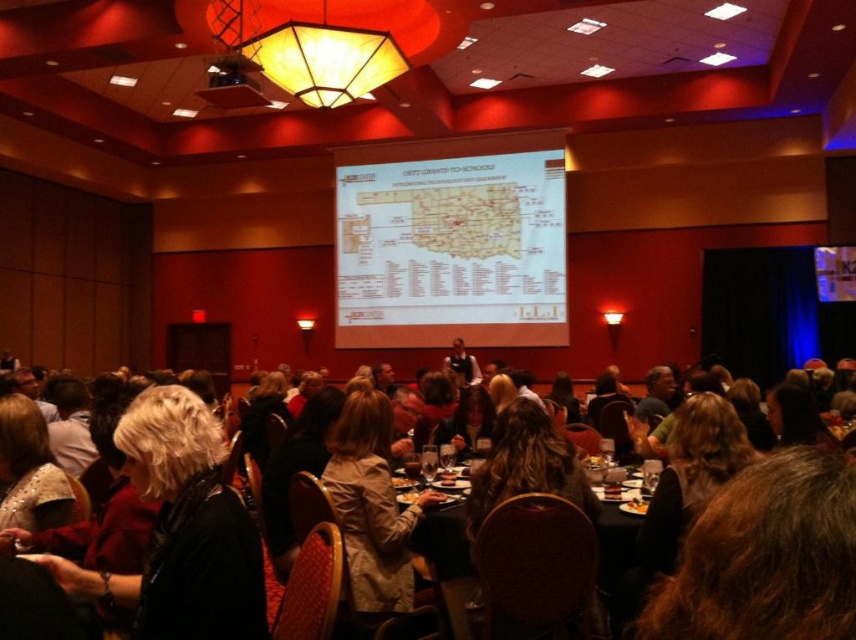
You are standing in the conference room and want to move to the point marked by the coordinates point (418, 317). If you can walk 1.5 meters per second, how long will it take you to reach the point?

The distance between you and the point (418, 317) is 12.99 meters. At a walking speed of 1.5 meters per second, it would take approximately 8.66 seconds to reach the point.

You are standing in the conference room and want to locate the white paper map at center. According to the coordinates provided, where should you look?

The white paper map at center is located at the coordinates point (450, 243).

You are a guest in the conference room and need to place a 1.5 meter wide laptop on the table. The table has the white paper map at center and brown leather chairs at center. Can the laptop fit on the table between these two items?

The white paper map at center is wider than the brown leather chairs at center. Since the laptop is 1.5 meters wide, the available space between them depends on their combined widths. However, without knowing the exact dimensions of the table and the distance between the map and chairs, it is impossible to determine if the laptop will fit.